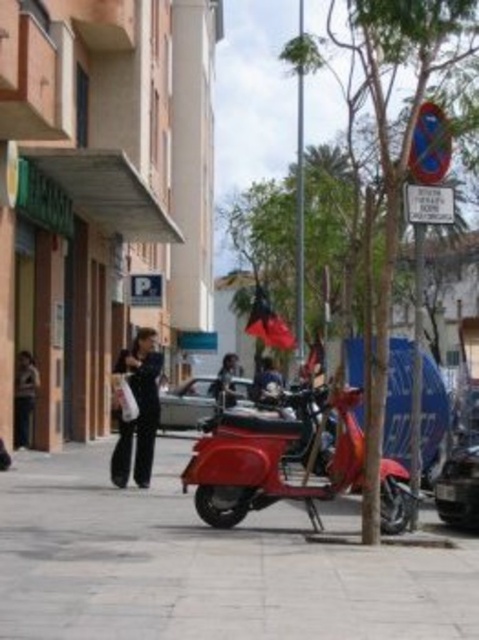
You are a delivery person who needs to park your bike between the smooth concrete pavement at center and the metallic silver car at lower right. Can you fit your bike there if your bike is 1.2 meters wide?

The smooth concrete pavement at center might be wider than metallic silver car at lower right, so it is possible that the space between them is wide enough to fit a bike that is 1.2 meters wide. However, since the exact width isn not specified, you should measure the space before parking.

You are a delivery person needing to place a heavy box on the ground. The box is too heavy to lift high. You see the smooth concrete pavement at center and the metallic silver car at lower right. Which surface can you use to place the box without lifting it high?

The smooth concrete pavement at center is below metallic silver car at lower right, so you can place the box on the smooth concrete pavement at center without lifting it high since it is lower than the car.

You are a fashion designer observing a person wearing both the black fabric pants at center and the dark brown leather jacket at center. According to the scene, which clothing item is positioned to the right?

The black fabric pants at center is positioned on the right side of dark brown leather jacket at center, so the black fabric pants at center is the clothing item positioned to the right.